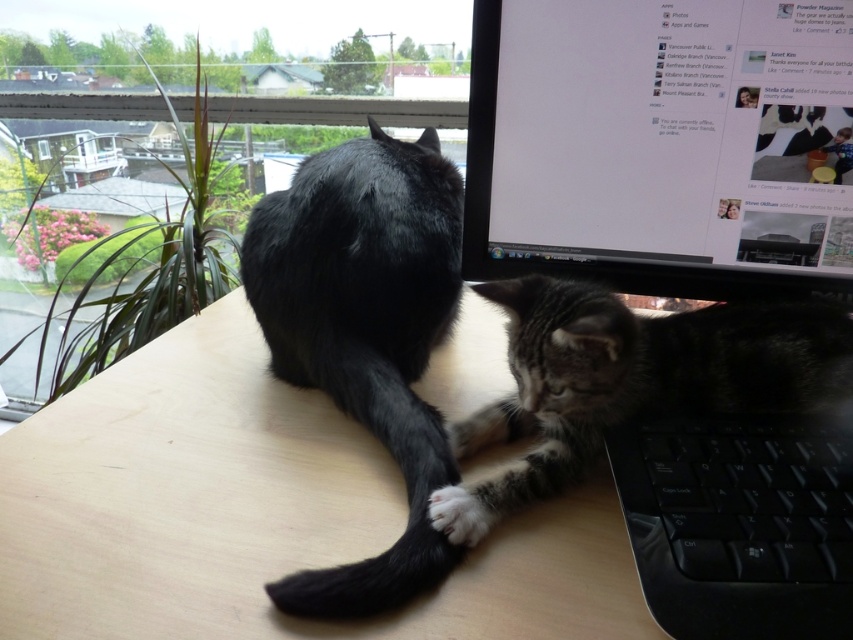
Consider the image. Who is positioned more to the right, matte black monitor at upper right or tabby fur cat at lower right?

Positioned to the right is matte black monitor at upper right.

Locate an element on the screen. The height and width of the screenshot is (640, 853). matte black monitor at upper right is located at coordinates (660, 145).

The image size is (853, 640). What do you see at coordinates (260, 513) in the screenshot? I see `wooden table at center` at bounding box center [260, 513].

Based on the photo, does wooden table at center appear under tabby fur cat at lower right?

Yes.

Does point (265, 353) lie behind point (582, 412)?

Yes, it is behind point (582, 412).

This screenshot has height=640, width=853. Identify the location of wooden table at center. (260, 513).

At what (x,y) coordinates should I click in order to perform the action: click on black plastic monitor at center. Please return your answer as a coordinate pair (x, y). Image resolution: width=853 pixels, height=640 pixels. Looking at the image, I should click on (663, 147).

Is black plastic monitor at center taller than black fur cat at center?

Yes.

Measure the distance between black plastic monitor at center and camera.

black plastic monitor at center and camera are 14.61 inches apart from each other.

What are the coordinates of `black plastic monitor at center` in the screenshot? It's located at (663, 147).